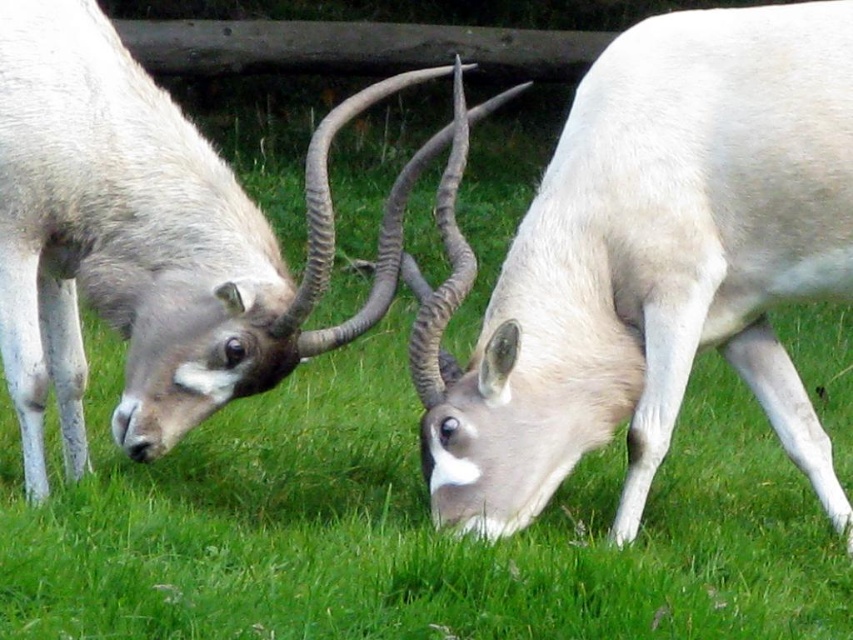
Does white matte antelope at center have a lesser height compared to smooth white antelope at center?

Incorrect, white matte antelope at center's height does not fall short of smooth white antelope at center's.

Does point (819, 182) lie behind point (64, 182)?

No, it is in front of (64, 182).

Who is more forward, (590,426) or (84,51)?

Point (84,51) is more forward.

Image resolution: width=853 pixels, height=640 pixels. In order to click on white matte antelope at center in this screenshot , I will do `click(650, 262)`.